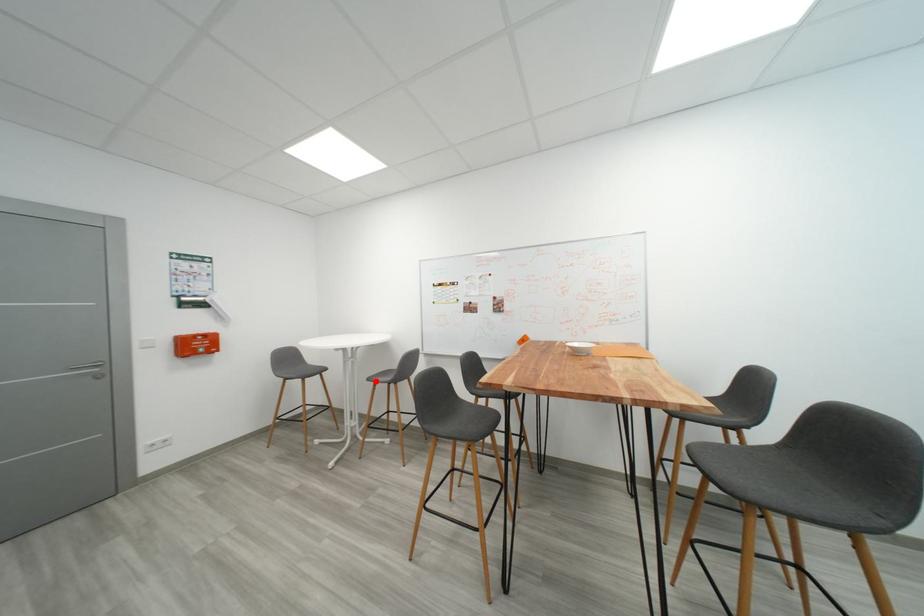
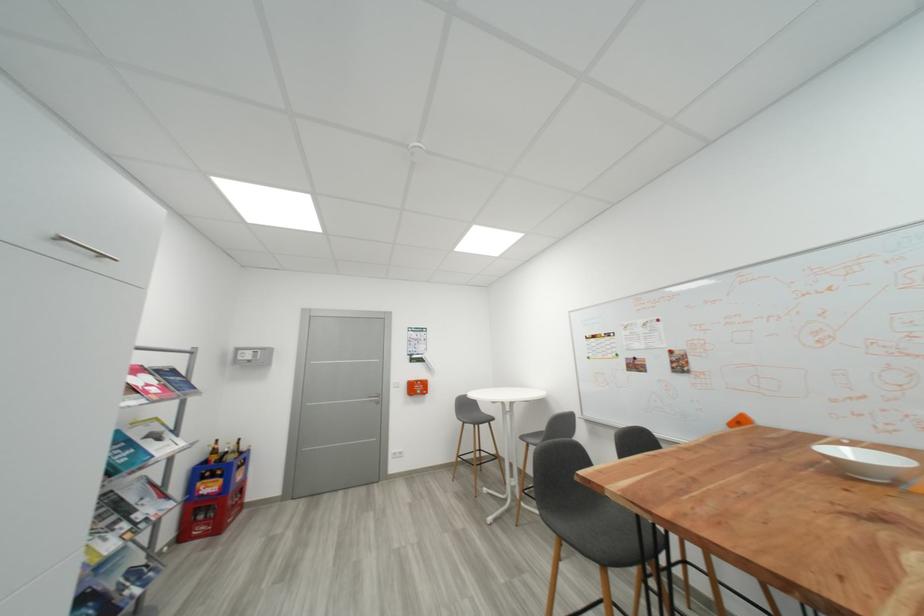
Locate, in the second image, the point that corresponds to the highlighted location in the first image.

(528, 439)